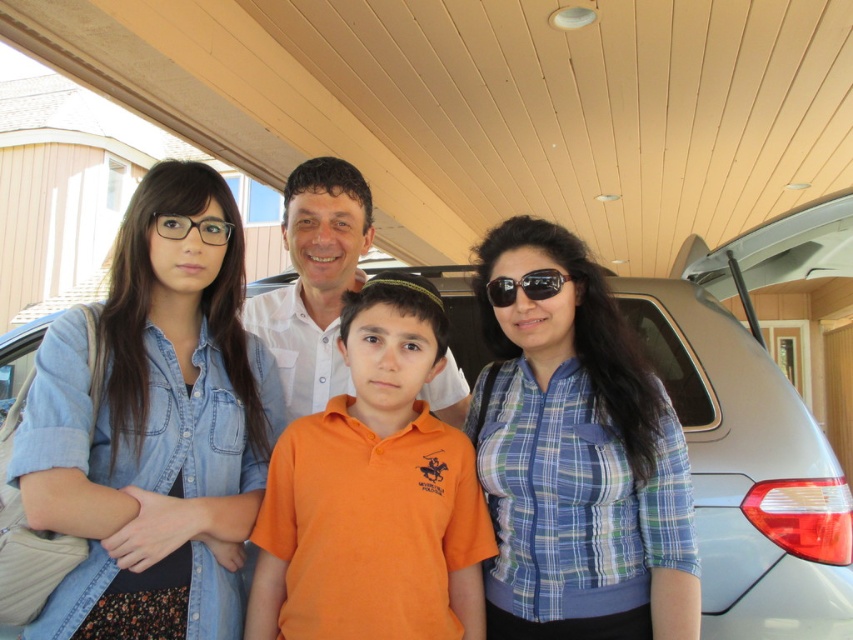
Is satin silver car at center closer to camera compared to orange cotton shirt at center?

No, satin silver car at center is further to the viewer.

Is point (654, 326) farther from viewer compared to point (436, 541)?

Yes, it is behind point (436, 541).

The image size is (853, 640). I want to click on satin silver car at center, so click(753, 429).

Who is positioned more to the right, orange cotton shirt at center or clear plastic glasses at upper left?

From the viewer's perspective, orange cotton shirt at center appears more on the right side.

From the picture: Who is shorter, orange cotton shirt at center or clear plastic glasses at upper left?

Standing shorter between the two is clear plastic glasses at upper left.

Find the location of a particular element. The height and width of the screenshot is (640, 853). orange cotton shirt at center is located at coordinates [374, 493].

Image resolution: width=853 pixels, height=640 pixels. In order to click on orange cotton shirt at center in this screenshot , I will do `click(374, 493)`.

Which is below, satin silver car at center or white cotton shirt at center?

satin silver car at center is below.

At what (x,y) coordinates should I click in order to perform the action: click on satin silver car at center. Please return your answer as a coordinate pair (x, y). The width and height of the screenshot is (853, 640). Looking at the image, I should click on (753, 429).